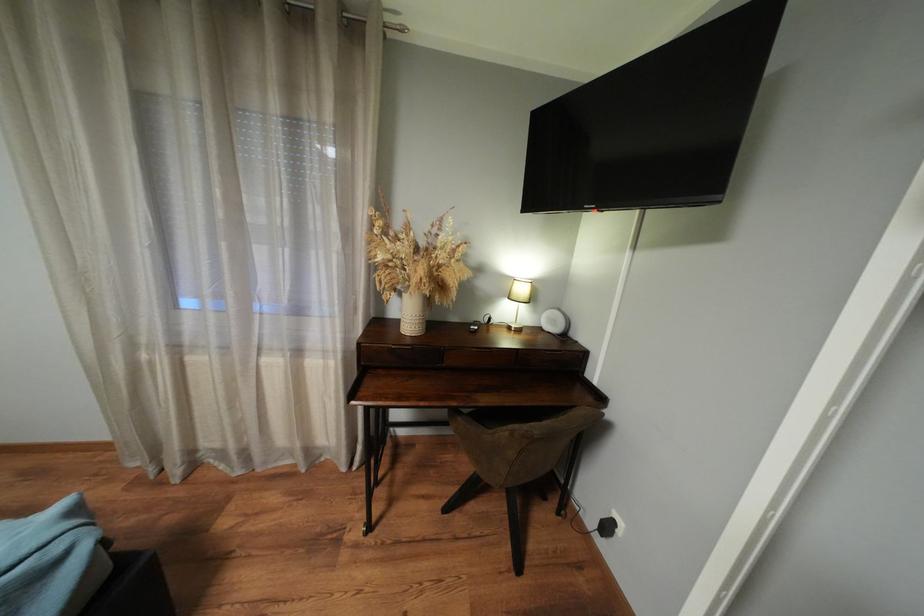
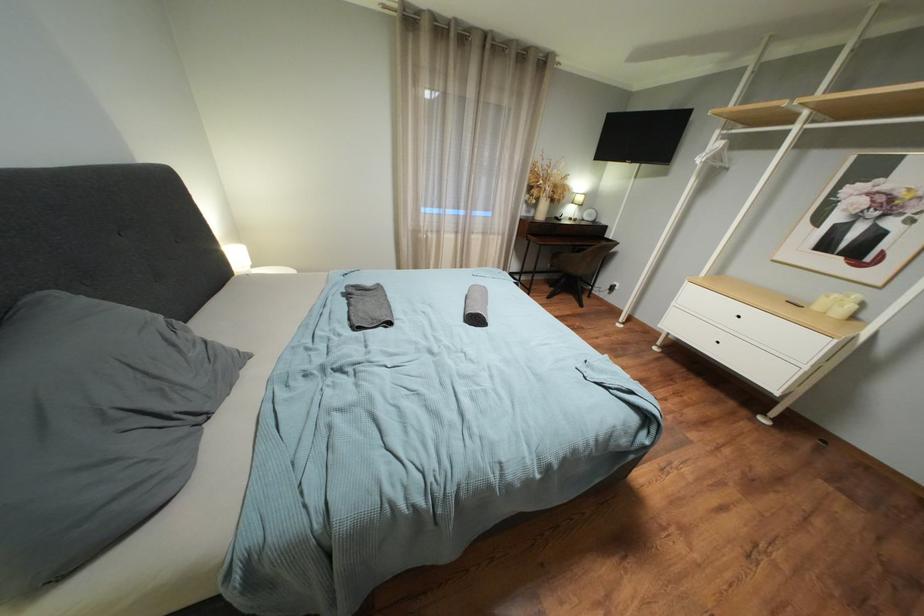
What movement of the cameraman would produce the second image?

The cameraman moved toward left, backward.